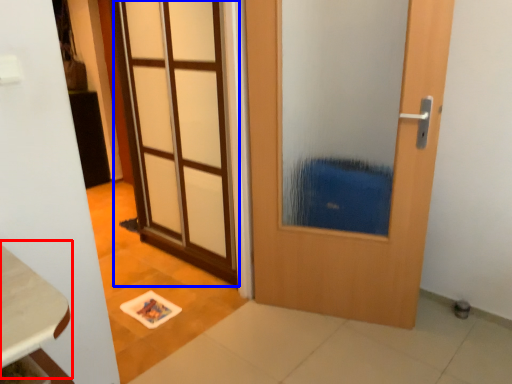
Question: Which object is closer to the camera taking this photo, table (highlighted by a red box) or door (highlighted by a blue box)?

Choices:
 (A) table
 (B) door

Answer: (A)